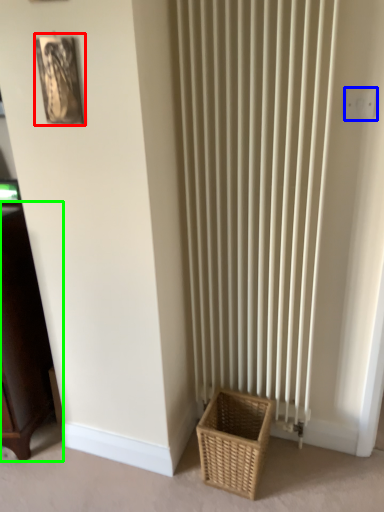
Question: Which is nearer to the picture frame (highlighted by a red box)? electric outlet (highlighted by a blue box) or furniture (highlighted by a green box).

Choices:
 (A) electric outlet
 (B) furniture

Answer: (B)